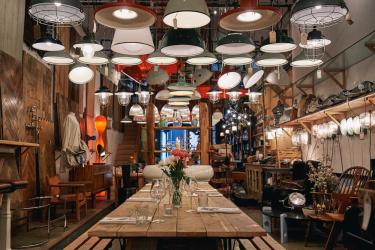
This screenshot has width=375, height=250. Identify the location of glass vase. (176, 199).